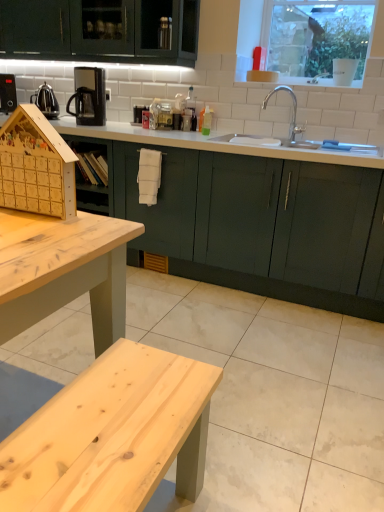
Identify the location of clear glass window at upper center. (302, 35).

The width and height of the screenshot is (384, 512). What are the coordinates of `white glossy countertop at center` in the screenshot? It's located at (255, 222).

The width and height of the screenshot is (384, 512). Describe the element at coordinates (46, 101) in the screenshot. I see `polished stainless steel kettle at left` at that location.

What do you see at coordinates (37, 165) in the screenshot?
I see `wooden advent calendar at left` at bounding box center [37, 165].

Where is `wooden advent calendar at left`? wooden advent calendar at left is located at coordinates (37, 165).

The height and width of the screenshot is (512, 384). Find the location of `black plastic coffee machine at upper left`. black plastic coffee machine at upper left is located at coordinates (89, 96).

You are a GUI agent. You are given a task and a screenshot of the screen. Output one action in this format:
    pyautogui.click(x=<x>, y=<y>)
    Task: Click on the clear glass window at upper center
    The height and width of the screenshot is (512, 384).
    Given the screenshot: What is the action you would take?
    pyautogui.click(x=302, y=35)

Is polished stainless steel kettle at left taller or shorter than clear glass window at upper center?

Considering their sizes, polished stainless steel kettle at left has less height than clear glass window at upper center.

In the scene shown: From the image's perspective, is polished stainless steel kettle at left located beneath clear glass window at upper center?

Yes.

How many degrees apart are the facing directions of polished stainless steel kettle at left and clear glass window at upper center?

The angle between the facing direction of polished stainless steel kettle at left and the facing direction of clear glass window at upper center is 5.61 degrees.

Identify the location of window that is above the polished stainless steel kettle at left (from the image's perspective). 302,35.

Does point (46, 93) lie behind point (312, 286)?

Yes, point (46, 93) is farther from viewer.

Which of these two, polished stainless steel kettle at left or white glossy countertop at center, is bigger?

With larger size is white glossy countertop at center.

Where is `countertop in front of the polished stainless steel kettle at left`? The height and width of the screenshot is (512, 384). countertop in front of the polished stainless steel kettle at left is located at coordinates (255, 222).

Is polished stainless steel kettle at left oriented away from white glossy countertop at center?

polished stainless steel kettle at left is not turned away from white glossy countertop at center.

Can you confirm if clear glass window at upper center is wider than wooden advent calendar at left?

Yes.

Does clear glass window at upper center have a smaller size compared to wooden advent calendar at left?

No.

From the picture: How different are the orientations of clear glass window at upper center and wooden advent calendar at left in degrees?

The facing directions of clear glass window at upper center and wooden advent calendar at left are 0.753 degrees apart.

Looking at this image, is clear glass window at upper center not near wooden advent calendar at left?

Yes, clear glass window at upper center and wooden advent calendar at left are located far from each other.

From the image's perspective, is polished stainless steel kettle at left above or below wooden advent calendar at left?

From the image's perspective, polished stainless steel kettle at left appears above wooden advent calendar at left.

Considering the sizes of polished stainless steel kettle at left and wooden advent calendar at left in the image, is polished stainless steel kettle at left taller or shorter than wooden advent calendar at left?

In the image, polished stainless steel kettle at left appears to be shorter than wooden advent calendar at left.

Considering the relative positions of polished stainless steel kettle at left and wooden advent calendar at left in the image provided, is polished stainless steel kettle at left to the right of wooden advent calendar at left from the viewer's perspective?

No, polished stainless steel kettle at left is not to the right of wooden advent calendar at left.

From a real-world perspective, is black plastic coffee machine at upper left located beneath wooden advent calendar at left?

Incorrect, from a real-world perspective, black plastic coffee machine at upper left is higher than wooden advent calendar at left.

Considering the sizes of black plastic coffee machine at upper left and wooden advent calendar at left in the image, is black plastic coffee machine at upper left taller or shorter than wooden advent calendar at left?

In the image, black plastic coffee machine at upper left appears to be taller than wooden advent calendar at left.

How many degrees apart are the facing directions of black plastic coffee machine at upper left and wooden advent calendar at left?

The angular difference between black plastic coffee machine at upper left and wooden advent calendar at left is 1.14 degrees.

Could you tell me if black plastic coffee machine at upper left is turned towards wooden advent calendar at left?

No.

At what (x,y) coordinates should I click in order to perform the action: click on tea pot located on the left of wooden advent calendar at left. Please return your answer as a coordinate pair (x, y). Looking at the image, I should click on (46, 101).

Looking at this image, could you tell me if wooden advent calendar at left is facing polished stainless steel kettle at left?

No, wooden advent calendar at left is not aimed at polished stainless steel kettle at left.

Looking at this image, is wooden advent calendar at left bigger or smaller than polished stainless steel kettle at left?

In the image, wooden advent calendar at left appears to be smaller than polished stainless steel kettle at left.

From the image's perspective, which object appears higher, wooden advent calendar at left or polished stainless steel kettle at left?

polished stainless steel kettle at left, from the image's perspective.

From the image's perspective, is black plastic coffee machine at upper left located beneath white glossy countertop at center?

Actually, black plastic coffee machine at upper left appears above white glossy countertop at center in the image.

Find the location of a particular element. coffee machine above the white glossy countertop at center (from the image's perspective) is located at coordinates point(89,96).

Locate an element on the screen. The width and height of the screenshot is (384, 512). window above the polished stainless steel kettle at left (from the image's perspective) is located at coordinates (302, 35).

Identify the location of countertop that is below the polished stainless steel kettle at left (from the image's perspective). Image resolution: width=384 pixels, height=512 pixels. (255, 222).

Based on the photo, based on their spatial positions, is white glossy countertop at center or polished stainless steel kettle at left further from black plastic coffee machine at upper left?

Based on the image, white glossy countertop at center appears to be further to black plastic coffee machine at upper left.

Based on their spatial positions, is black plastic coffee machine at upper left or white glossy countertop at center further from polished stainless steel kettle at left?

white glossy countertop at center lies further to polished stainless steel kettle at left than the other object.

Based on their spatial positions, is black plastic coffee machine at upper left or polished stainless steel kettle at left further from wooden advent calendar at left?

Based on the image, polished stainless steel kettle at left appears to be further to wooden advent calendar at left.

Based on their spatial positions, is wooden advent calendar at left or black plastic coffee machine at upper left closer to clear glass window at upper center?

black plastic coffee machine at upper left.

From the image, which object appears to be nearer to clear glass window at upper center, black plastic coffee machine at upper left or white glossy countertop at center?

white glossy countertop at center is closer to clear glass window at upper center.

Looking at this image, when comparing their distances from wooden advent calendar at left, does black plastic coffee machine at upper left or white glossy countertop at center seem further?

black plastic coffee machine at upper left.

Looking at the image, which one is located further to clear glass window at upper center, white glossy countertop at center or polished stainless steel kettle at left?

Based on the image, polished stainless steel kettle at left appears to be further to clear glass window at upper center.

Looking at the image, which one is located further to black plastic coffee machine at upper left, polished stainless steel kettle at left or wooden advent calendar at left?

Based on the image, wooden advent calendar at left appears to be further to black plastic coffee machine at upper left.

Locate an element on the screen. This screenshot has width=384, height=512. countertop between black plastic coffee machine at upper left and clear glass window at upper center in the horizontal direction is located at coordinates (255, 222).

Where is `coffee machine between polished stainless steel kettle at left and clear glass window at upper center`? The width and height of the screenshot is (384, 512). coffee machine between polished stainless steel kettle at left and clear glass window at upper center is located at coordinates (89, 96).

This screenshot has width=384, height=512. I want to click on countertop between polished stainless steel kettle at left and clear glass window at upper center, so click(255, 222).

Where is `appliance between black plastic coffee machine at upper left and clear glass window at upper center`? This screenshot has width=384, height=512. appliance between black plastic coffee machine at upper left and clear glass window at upper center is located at coordinates (37, 165).